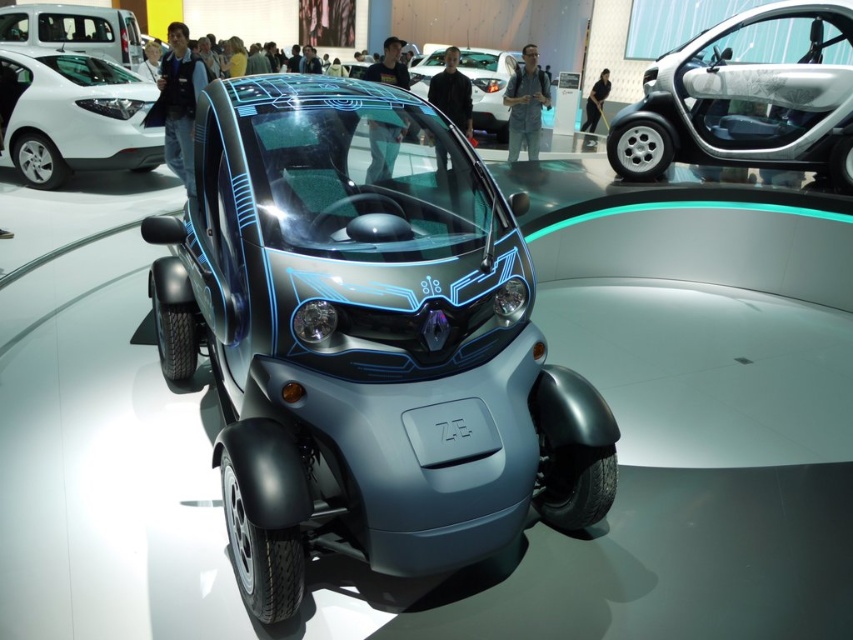
You are at an auto show and want to take a photo of the white glossy hatchback at upper left and the matte white van at upper left. Which one should you focus on first to ensure it appears clearer in the photo?

The white glossy hatchback at upper left is in front of the matte white van at upper left, so focusing on it first will ensure it appears clearer in the photo.

You are at an auto show and want to park your car between the white glossy hatchback at upper left and the matte white van at upper left. Given that your car is 4 meters long, can you fit it there?

The white glossy hatchback at upper left occupies less space than matte white van at upper left, but without knowing the exact distance between them, it is impossible to determine if your 4 meter car will fit.

You are standing at the point marked as point (682, 58) and want to walk to the entrance of the auto show located 4.93 meters away. Is there enough space to walk straight to the entrance without any obstacles?

The distance between you and the entrance is exactly 4.93 meters, so there is enough space to walk straight to the entrance without any obstacles.